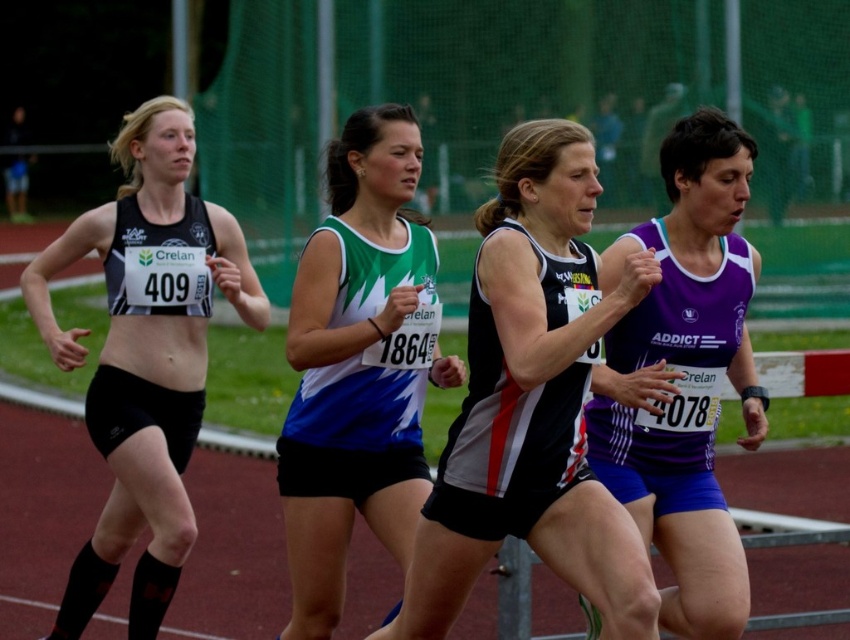
Does black and white athletic top at center appear under green and white jersey at center?

Correct, black and white athletic top at center is located below green and white jersey at center.

Which is in front, point (500, 326) or point (319, 492)?

Positioned in front is point (500, 326).

The height and width of the screenshot is (640, 850). In order to click on black and white athletic top at center in this screenshot , I will do `click(531, 401)`.

Consider the image. Can you confirm if black and white athletic top at center is shorter than matte black tank top at left?

Correct, black and white athletic top at center is not as tall as matte black tank top at left.

What do you see at coordinates (531, 401) in the screenshot?
I see `black and white athletic top at center` at bounding box center [531, 401].

Where is `black and white athletic top at center`? The width and height of the screenshot is (850, 640). black and white athletic top at center is located at coordinates (531, 401).

Measure the distance from black and white athletic top at center to purple synthetic running top at center.

black and white athletic top at center is 25.97 inches from purple synthetic running top at center.

Is black and white athletic top at center bigger than purple synthetic running top at center?

Yes.

Does point (520, 536) come behind point (718, 305)?

That is False.

Locate an element on the screen. Image resolution: width=850 pixels, height=640 pixels. black and white athletic top at center is located at coordinates (531, 401).